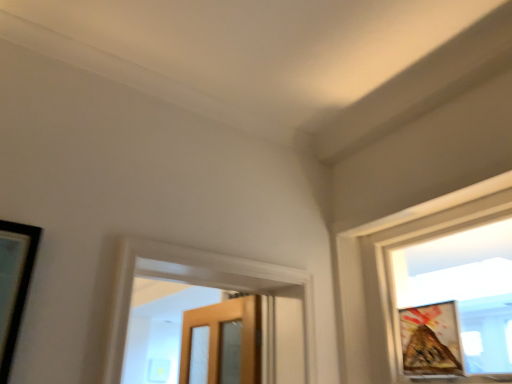
Describe the element at coordinates (391, 280) in the screenshot. Image resolution: width=512 pixels, height=384 pixels. I see `matte glass window at upper right` at that location.

Measure the distance between matte glass window at upper right and camera.

They are 5.46 feet apart.

Identify the location of matte glass window at upper right. This screenshot has height=384, width=512. (391, 280).

The width and height of the screenshot is (512, 384). What do you see at coordinates (431, 339) in the screenshot?
I see `wooden textured picture frame at right` at bounding box center [431, 339].

This screenshot has height=384, width=512. What are the coordinates of `wooden textured picture frame at right` in the screenshot? It's located at (431, 339).

At what (x,y) coordinates should I click in order to perform the action: click on matte glass window at upper right. Please return your answer as a coordinate pair (x, y). This screenshot has width=512, height=384. Looking at the image, I should click on coord(391,280).

Is wooden textured picture frame at right to the left of matte glass window at upper right from the viewer's perspective?

Indeed, wooden textured picture frame at right is positioned on the left side of matte glass window at upper right.

Between wooden textured picture frame at right and matte glass window at upper right, which one is positioned behind?

wooden textured picture frame at right is further away from the camera.

Which point is more forward, [411,321] or [370,296]?

The point [411,321] is in front.

From the image's perspective, which one is positioned lower, wooden textured picture frame at right or matte glass window at upper right?

wooden textured picture frame at right.

From a real-world perspective, does wooden textured picture frame at right stand above matte glass window at upper right?

No, from a real-world perspective, wooden textured picture frame at right is not over matte glass window at upper right

Is wooden textured picture frame at right wider than matte glass window at upper right?

No.

Is wooden textured picture frame at right shorter than matte glass window at upper right?

Yes.

Who is smaller, wooden textured picture frame at right or matte glass window at upper right?

With smaller size is wooden textured picture frame at right.

Can we say wooden textured picture frame at right lies outside matte glass window at upper right?

No, most part of wooden textured picture frame at right lies within matte glass window at upper right.

Can you see wooden textured picture frame at right touching matte glass window at upper right?

wooden textured picture frame at right and matte glass window at upper right are not in contact.

Is wooden textured picture frame at right oriented towards matte glass window at upper right?

Yes, wooden textured picture frame at right is aimed at matte glass window at upper right.

How many degrees apart are the facing directions of wooden textured picture frame at right and matte glass window at upper right?

wooden textured picture frame at right and matte glass window at upper right are facing 180 degrees away from each other.

Image resolution: width=512 pixels, height=384 pixels. Identify the location of window above the wooden textured picture frame at right (from a real-world perspective). (391, 280).

Which object is positioned more to the right, matte glass window at upper right or wooden textured picture frame at right?

matte glass window at upper right.

Is the depth of matte glass window at upper right less than that of wooden textured picture frame at right?

Yes, it is in front of wooden textured picture frame at right.

Is point (502, 214) less distant than point (403, 351)?

Yes, it is in front of point (403, 351).

From the image's perspective, who appears lower, matte glass window at upper right or wooden textured picture frame at right?

wooden textured picture frame at right is shown below in the image.

From a real-world perspective, which is physically below, matte glass window at upper right or wooden textured picture frame at right?

wooden textured picture frame at right.

Does matte glass window at upper right have a lesser width compared to wooden textured picture frame at right?

Incorrect, the width of matte glass window at upper right is not less than that of wooden textured picture frame at right.

In the scene shown: Is matte glass window at upper right taller than wooden textured picture frame at right?

Yes, matte glass window at upper right is taller than wooden textured picture frame at right.

Which of these two, matte glass window at upper right or wooden textured picture frame at right, is bigger?

matte glass window at upper right.

Do you think matte glass window at upper right is within wooden textured picture frame at right, or outside of it?

matte glass window at upper right cannot be found inside wooden textured picture frame at right.

Are matte glass window at upper right and wooden textured picture frame at right beside each other?

They are not placed beside each other.

Is matte glass window at upper right facing away from wooden textured picture frame at right?

Yes, matte glass window at upper right is positioned with its back facing wooden textured picture frame at right.

The width and height of the screenshot is (512, 384). What are the coordinates of `window above the wooden textured picture frame at right (from a real-world perspective)` in the screenshot? It's located at tap(391, 280).

This screenshot has height=384, width=512. In order to click on picture frame below the matte glass window at upper right (from the image's perspective) in this screenshot , I will do `click(431, 339)`.

Find the location of a particular element. The width and height of the screenshot is (512, 384). window that is on the right side of wooden textured picture frame at right is located at coordinates (391, 280).